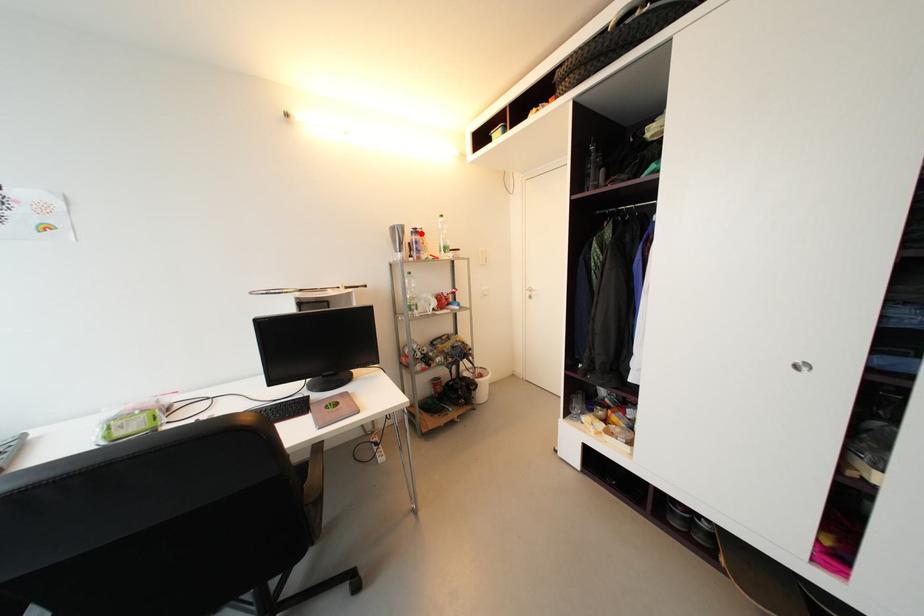
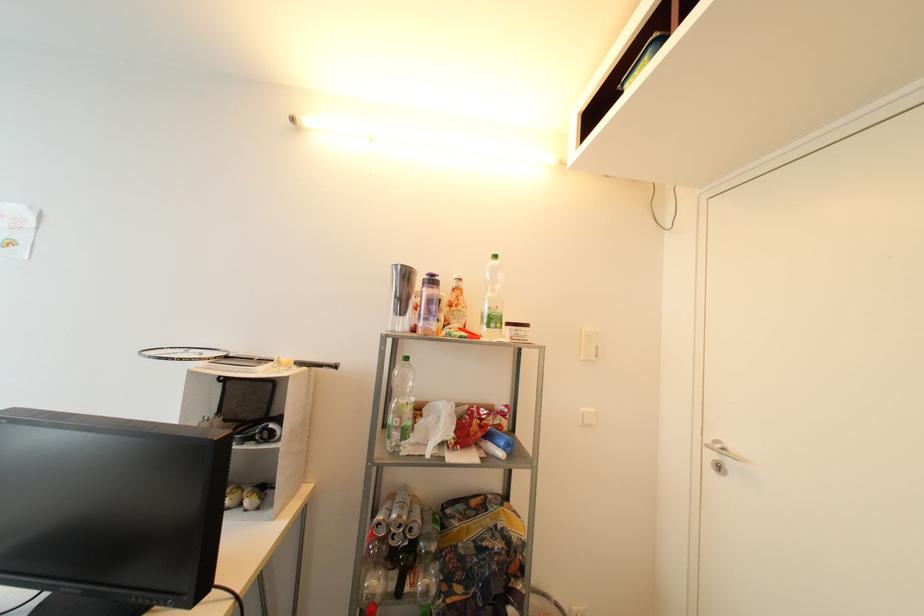
Where in the second image is the point corresponding to the highlighted location from the first image?

(438, 283)